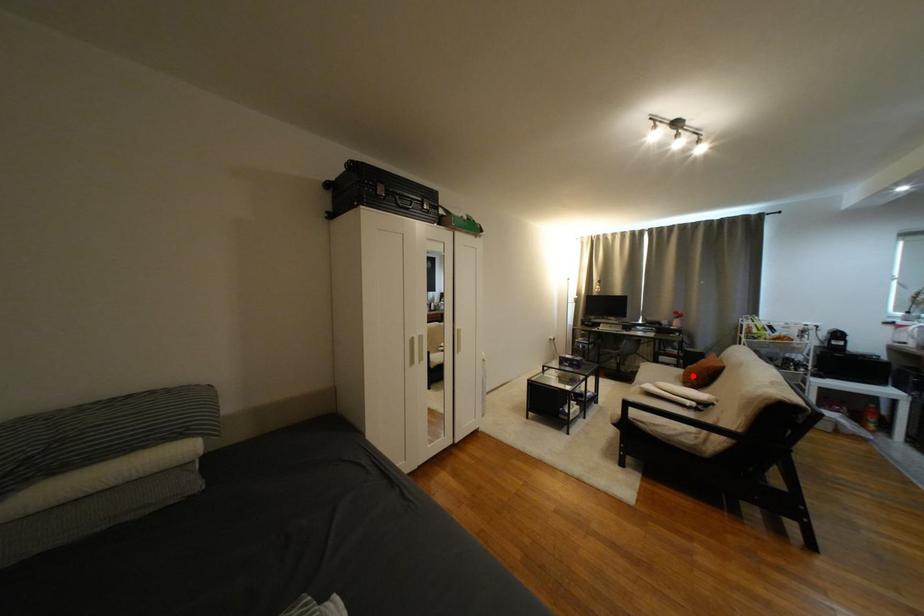
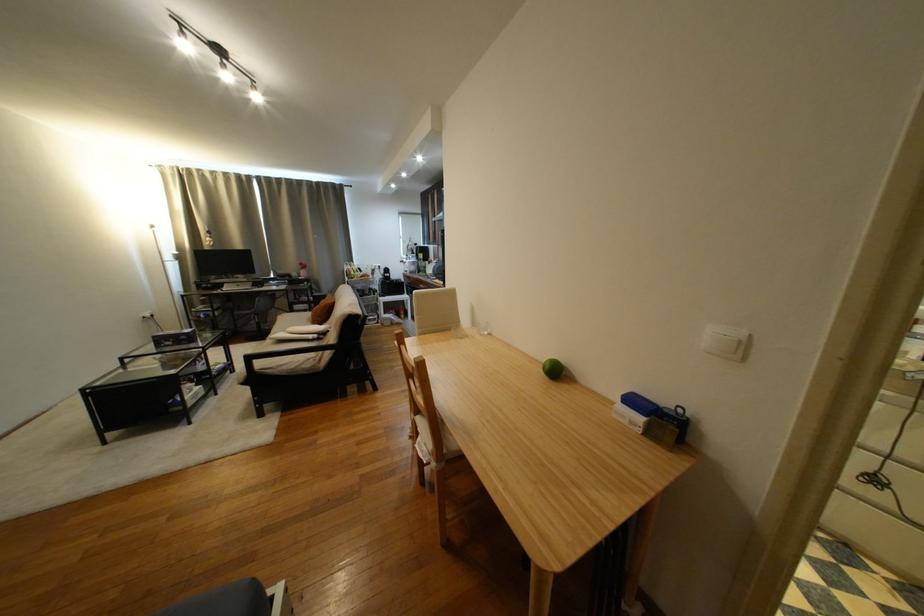
The point at the highlighted location is marked in the first image. Where is the corresponding point in the second image?

(321, 317)